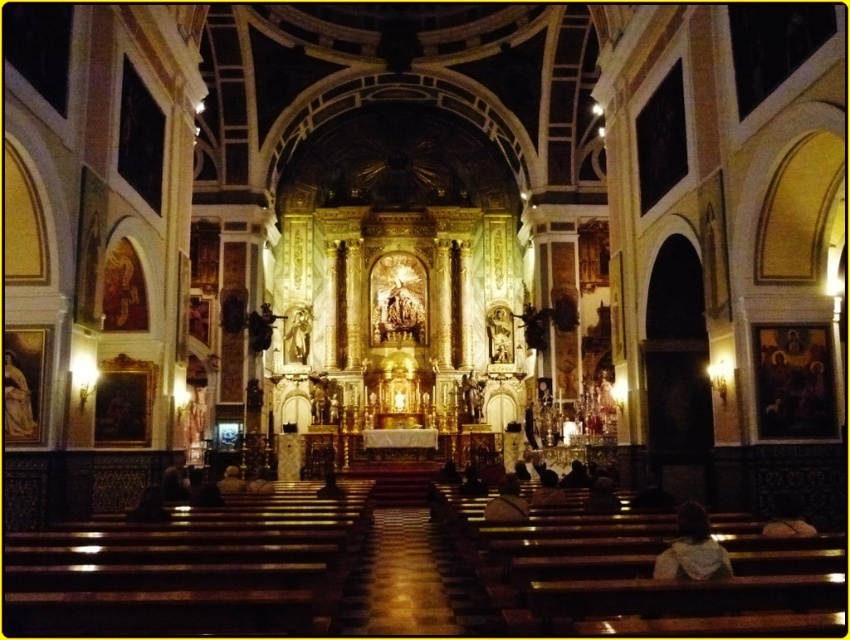
Which is below, brown leather jacket at lower right or dark brown leather jacket at lower center?

dark brown leather jacket at lower center is lower down.

The width and height of the screenshot is (850, 640). Describe the element at coordinates (786, 516) in the screenshot. I see `brown leather jacket at lower right` at that location.

The image size is (850, 640). Identify the location of brown leather jacket at lower right. click(786, 516).

Can you confirm if brown leather jacket at lower right is positioned to the left of dark brown leather shoe at lower center?

Incorrect, brown leather jacket at lower right is not on the left side of dark brown leather shoe at lower center.

Can you confirm if brown leather jacket at lower right is taller than dark brown leather shoe at lower center?

No.

The height and width of the screenshot is (640, 850). In order to click on brown leather jacket at lower right in this screenshot , I will do [x=786, y=516].

Find the location of a particular element. The width and height of the screenshot is (850, 640). light brown leather jacket at lower right is located at coordinates (692, 548).

Is light brown leather jacket at lower right thinner than dark brown leather shoe at lower center?

No.

Is point (664, 561) positioned in front of point (488, 515)?

That is True.

Locate an element on the screen. This screenshot has width=850, height=640. light brown leather jacket at lower right is located at coordinates (692, 548).